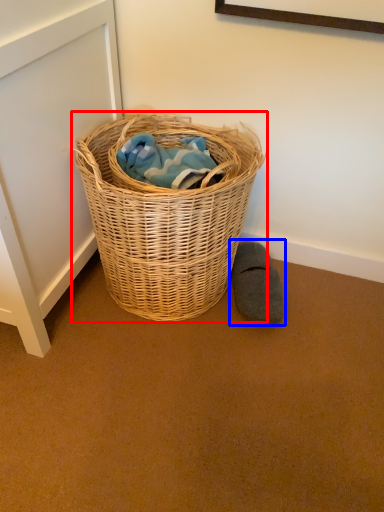
Question: Among these objects, which one is farthest to the camera, picnic basket (highlighted by a red box) or footwear (highlighted by a blue box)?

Choices:
 (A) picnic basket
 (B) footwear

Answer: (B)